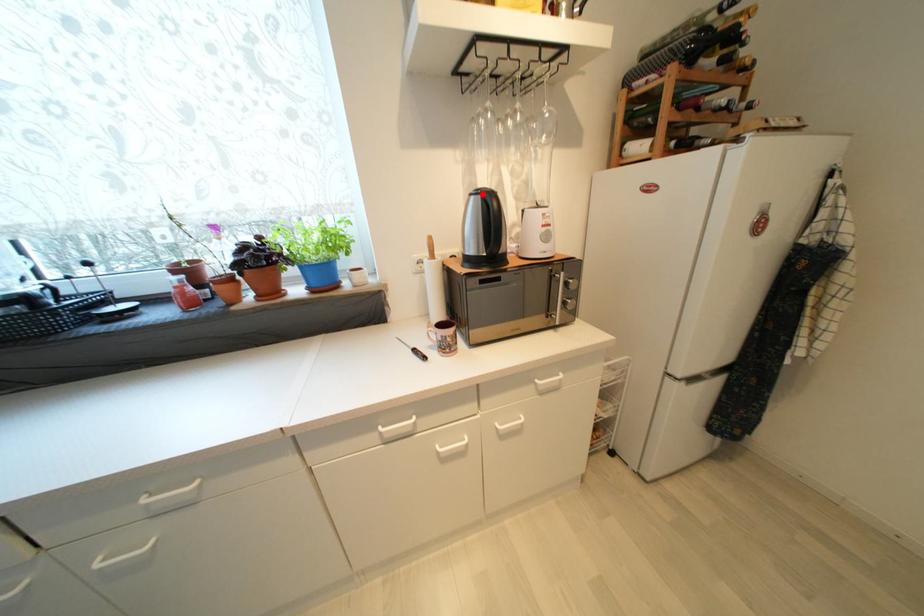
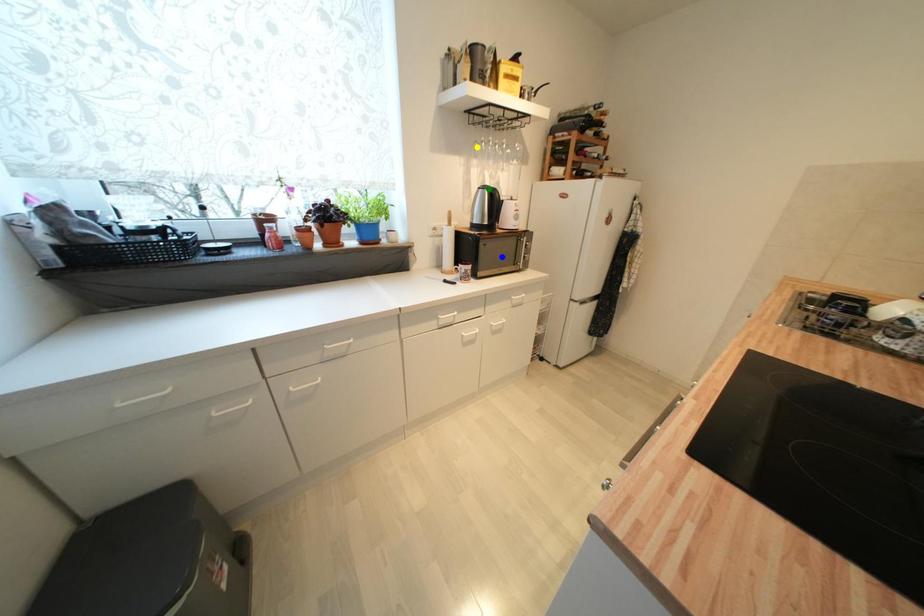
Question: I am providing you with two images of the same scene from different viewpoints. A red point is marked on the first image. You are given multiple points on the second image. Which mark in image 2 goes with the point in image 1?

Choices:
 (A) blue point
 (B) yellow point
 (C) green point

Answer: (C)